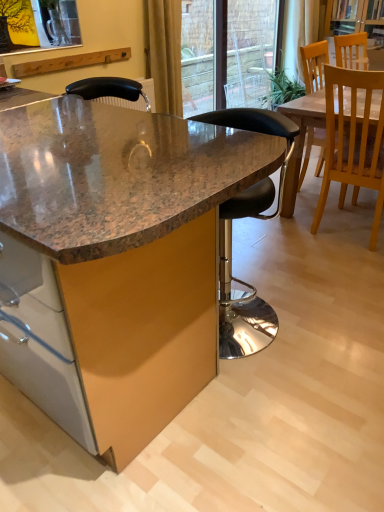
Question: Is transparent glass door at upper center shorter than black leather stool at center, the 1th chair viewed from the left?

Choices:
 (A) yes
 (B) no

Answer: (B)

Question: From the image's perspective, is transparent glass door at upper center below black leather stool at center, positioned as the 3th chair in right-to-left order?

Choices:
 (A) no
 (B) yes

Answer: (A)

Question: Does transparent glass door at upper center have a smaller size compared to black leather stool at center, positioned as the 3th chair in right-to-left order?

Choices:
 (A) yes
 (B) no

Answer: (A)

Question: From the image's perspective, is transparent glass door at upper center on black leather stool at center, the 1th chair viewed from the left?

Choices:
 (A) no
 (B) yes

Answer: (B)

Question: Is transparent glass door at upper center wider than black leather stool at center, the 1th chair viewed from the left?

Choices:
 (A) yes
 (B) no

Answer: (B)

Question: Is the position of transparent glass door at upper center less distant than that of black leather stool at center, positioned as the 3th chair in right-to-left order?

Choices:
 (A) yes
 (B) no

Answer: (B)

Question: Is wooden chair at upper right, which is the 1th chair from right to left, at the back of black leather stool at center, the 1th chair viewed from the left?

Choices:
 (A) no
 (B) yes

Answer: (B)

Question: Are black leather stool at center, positioned as the 3th chair in right-to-left order, and wooden chair at upper right, which is the 1th chair from right to left, beside each other?

Choices:
 (A) yes
 (B) no

Answer: (B)

Question: Is wooden chair at upper right, positioned as the 3th chair in left-to-right order, completely or partially inside black leather stool at center, positioned as the 3th chair in right-to-left order?

Choices:
 (A) yes
 (B) no

Answer: (B)

Question: From a real-world perspective, is black leather stool at center, the 1th chair viewed from the left, under wooden chair at upper right, which is the 1th chair from right to left?

Choices:
 (A) yes
 (B) no

Answer: (A)

Question: Is black leather stool at center, positioned as the 3th chair in right-to-left order, taller than wooden chair at upper right, which is the 1th chair from right to left?

Choices:
 (A) yes
 (B) no

Answer: (A)

Question: Is black leather stool at center, positioned as the 3th chair in right-to-left order, facing towards wooden chair at upper right, positioned as the 3th chair in left-to-right order?

Choices:
 (A) yes
 (B) no

Answer: (B)

Question: Is black leather stool at center, the 1th chair viewed from the left, closer to camera compared to yellow fabric curtain at upper center, positioned as the first curtain in bottom-to-top order?

Choices:
 (A) no
 (B) yes

Answer: (B)